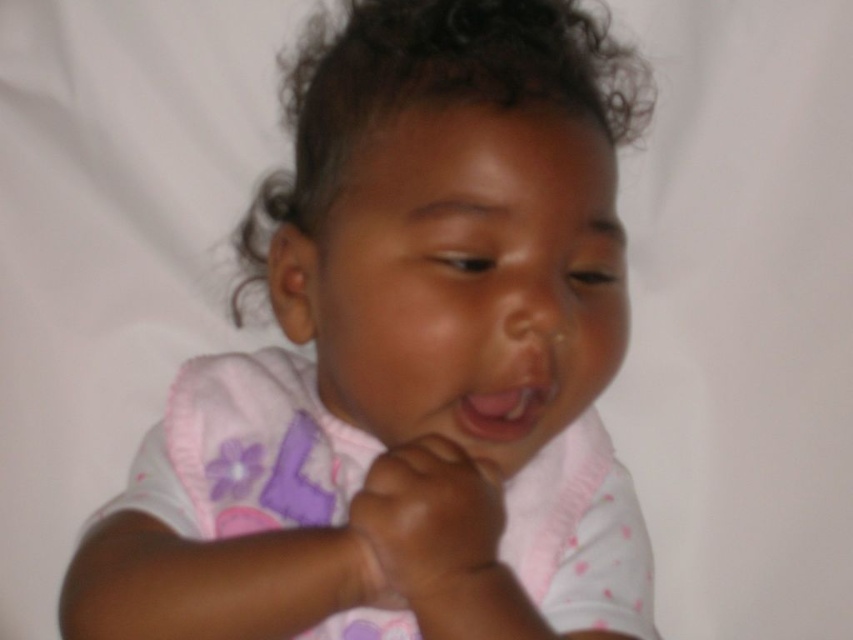
You are an artist trying to draw this scene. You need to decide which of the two points, point (653,637) or point (521,392), should be placed closer to the viewer in your drawing. Based on the image, which point should you draw closer?

Point (653,637) is further to the viewer than point (521,392), so you should draw point (653,637) closer to the viewer.

Based on the scene description, which object is larger in size between the pink fabric toddler at center and the pink matte lips at center?

The pink fabric toddler at center is much taller than the pink matte lips at center.

Looking at the image of the child, which object is positioned to the left of the other between the smooth skin hand at center and the pink matte lips at center?

The smooth skin hand at center is positioned to the left of the pink matte lips at center.